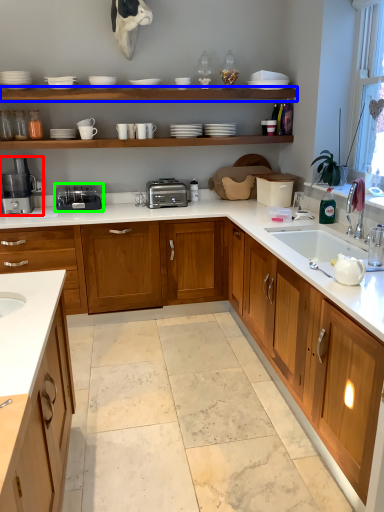
Question: Considering the real-world distances, which object is farthest from coffee machine (highlighted by a red box)? shelf (highlighted by a blue box) or appliance (highlighted by a green box)?

Choices:
 (A) shelf
 (B) appliance

Answer: (A)